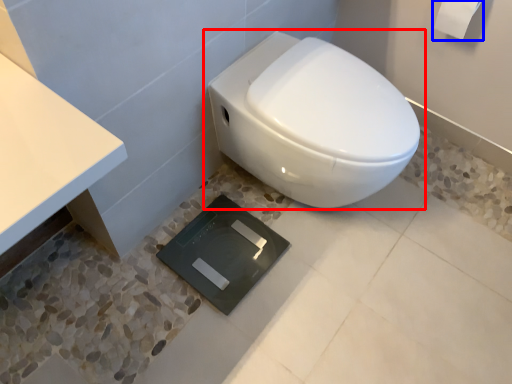
Question: Which object appears closest to the camera in this image, toilet (highlighted by a red box) or toilet paper (highlighted by a blue box)?

Choices:
 (A) toilet
 (B) toilet paper

Answer: (A)